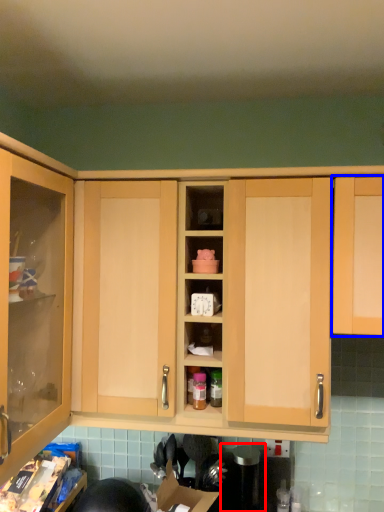
Question: Which of the following is the farthest to the observer, appliance (highlighted by a red box) or cabinetry (highlighted by a blue box)?

Choices:
 (A) appliance
 (B) cabinetry

Answer: (A)